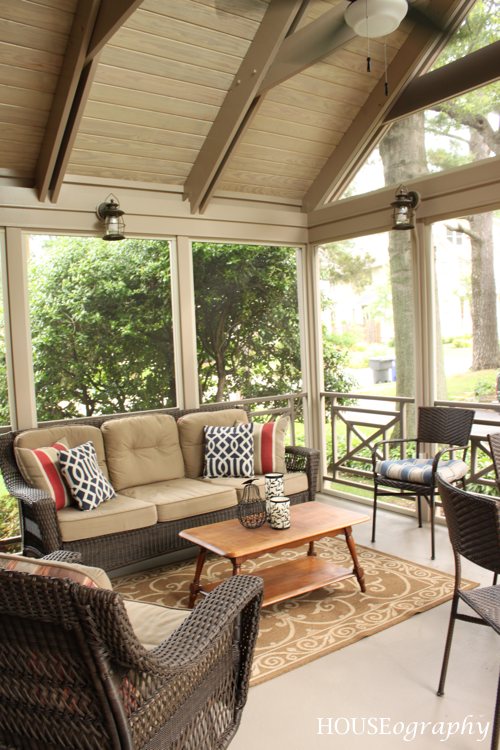
Identify the location of wicker. (187, 691), (473, 523), (446, 423), (499, 453), (122, 546).